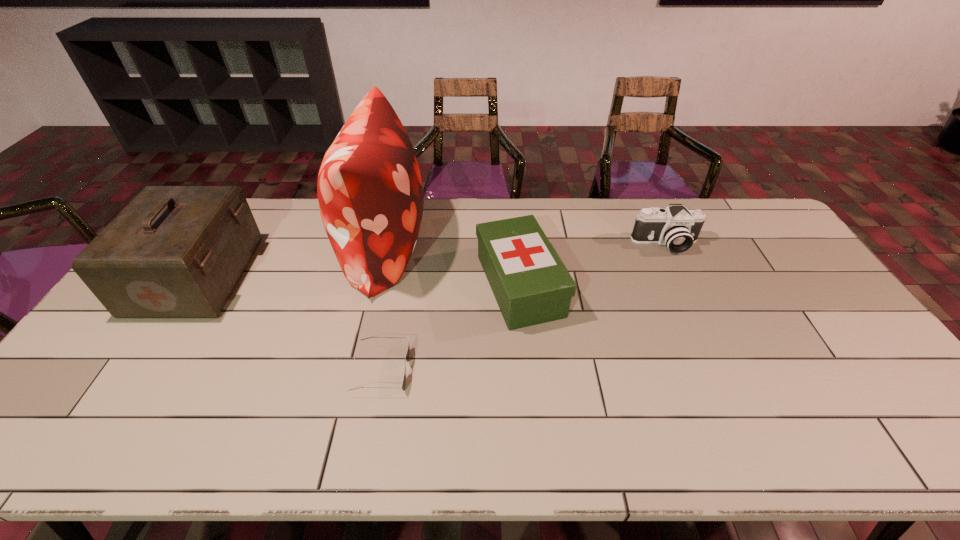
Identify the location of vacant area in the image that satisfies the following two spatial constraints: 1. on the front side of the rightmost object; 2. on the front-facing side of the cushion. (666, 248).

Find the location of `free space that satisfies the following two spatial constraints: 1. on the back side of the camera; 2. on the right side of the right first-aid kit`. free space that satisfies the following two spatial constraints: 1. on the back side of the camera; 2. on the right side of the right first-aid kit is located at coordinates (516, 244).

In order to click on vacant space that satisfies the following two spatial constraints: 1. on the front-facing side of the cushion; 2. on the left side of the shorter first-aid kit in this screenshot , I will do coord(374,285).